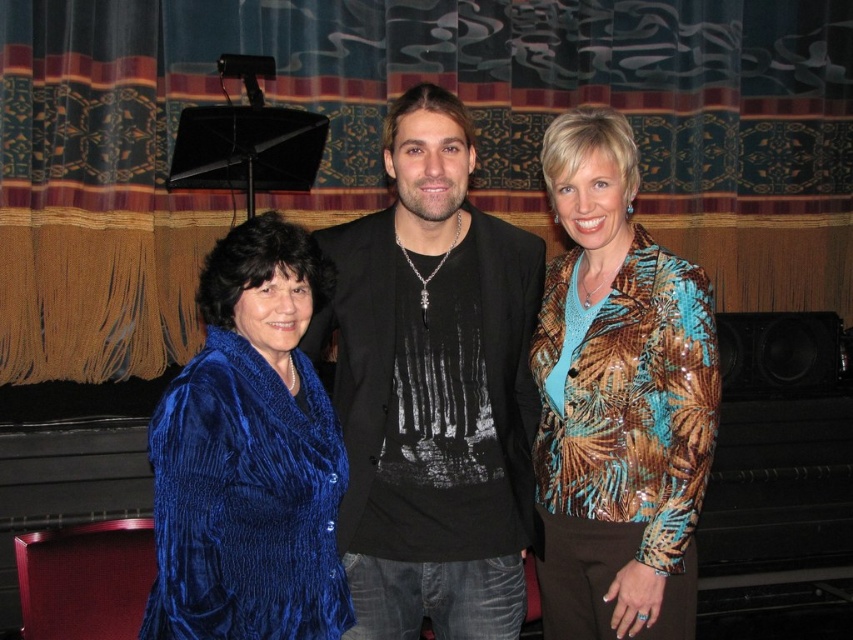
Question: Does velvet blue dress at left have a larger size compared to velvet blue jacket at left?

Choices:
 (A) no
 (B) yes

Answer: (B)

Question: Estimate the real-world distances between objects in this image. Which object is closer to the velvet blue dress at left?

Choices:
 (A) velvet blue curtain at center
 (B) velvet blue jacket at left

Answer: (B)

Question: Which point is farther to the camera?

Choices:
 (A) metallic sequined jacket at center
 (B) velvet blue dress at left
 (C) velvet blue curtain at center

Answer: (C)

Question: Does velvet blue dress at left have a greater width compared to black velvet jacket at center?

Choices:
 (A) yes
 (B) no

Answer: (A)

Question: Estimate the real-world distances between objects in this image. Which object is farther from the black velvet jacket at center?

Choices:
 (A) velvet blue curtain at center
 (B) metallic sequined jacket at center
 (C) velvet blue jacket at left
 (D) velvet blue dress at left

Answer: (A)

Question: Can you confirm if velvet blue curtain at center is positioned below metallic sequined jacket at center?

Choices:
 (A) no
 (B) yes

Answer: (A)